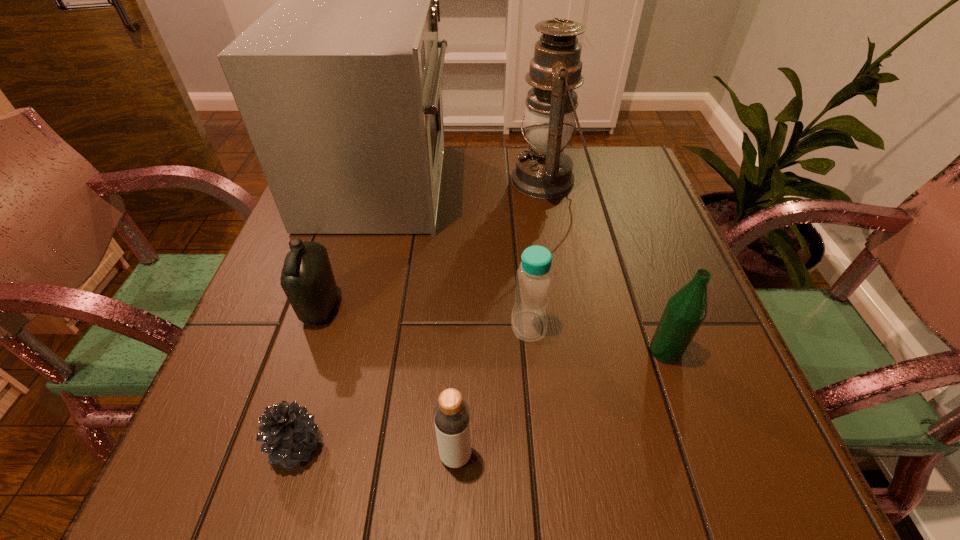
The height and width of the screenshot is (540, 960). In order to click on free area in between the leftmost bottle and the second bottle from left to right in this screenshot , I will do `click(388, 381)`.

Image resolution: width=960 pixels, height=540 pixels. Identify the location of vacant area that lies between the toaster oven and the shortest object. (338, 315).

Where is `unoccupied area between the toaster oven and the pinecone`? The height and width of the screenshot is (540, 960). unoccupied area between the toaster oven and the pinecone is located at coordinates (338, 315).

This screenshot has width=960, height=540. In order to click on vacant area between the fourth object from right to left and the rightmost bottle in this screenshot , I will do `click(561, 403)`.

I want to click on free space between the leftmost bottle and the second bottle from right to left, so click(424, 316).

Image resolution: width=960 pixels, height=540 pixels. Identify the location of unoccupied position between the oil lamp and the toaster oven. (464, 183).

I want to click on free space that is in between the rightmost bottle and the shortest object, so click(481, 398).

Image resolution: width=960 pixels, height=540 pixels. What are the coordinates of `unoccupied position between the second bottle from right to left and the third bottle from right to left` in the screenshot? It's located at (492, 390).

Locate which object is the second closest to the pinecone. Please provide its 2D coordinates. Your answer should be formatted as a tuple, i.e. [(x, y)], where the tuple contains the x and y coordinates of a point satisfying the conditions above.

[(307, 279)]

Select which object is the closest to the pinecone. Please provide its 2D coordinates. Your answer should be formatted as a tuple, i.e. [(x, y)], where the tuple contains the x and y coordinates of a point satisfying the conditions above.

[(451, 414)]